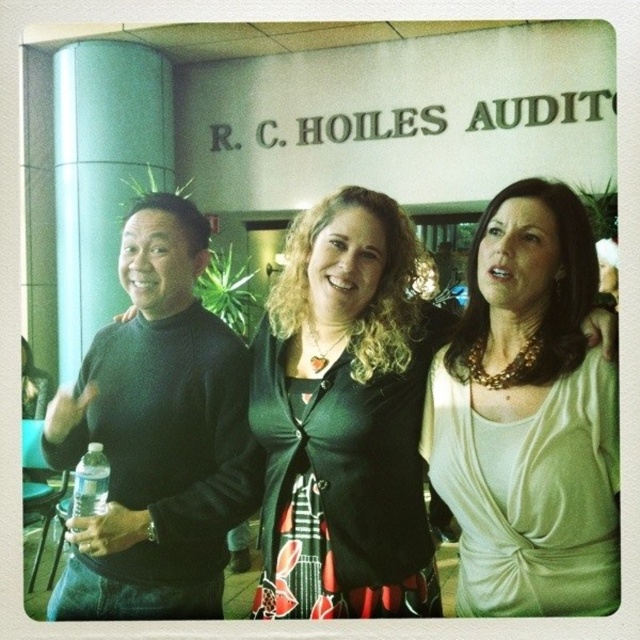
Question: Which point appears closest to the camera in this image?

Choices:
 (A) (108, 468)
 (B) (296, 582)
 (C) (518, 326)

Answer: (C)

Question: From the image, what is the correct spatial relationship of black matte sweater at left in relation to clear plastic bottle at lower left?

Choices:
 (A) above
 (B) below

Answer: (A)

Question: Does black matte cardigan at center have a greater width compared to black matte sweater at left?

Choices:
 (A) yes
 (B) no

Answer: (A)

Question: Which of the following is the farthest from the observer?

Choices:
 (A) (104, 388)
 (B) (76, 492)
 (C) (484, 365)

Answer: (A)

Question: Which of the following is the closest to the observer?

Choices:
 (A) click(390, 268)
 (B) click(76, 531)
 (C) click(563, 232)
 (D) click(100, 554)

Answer: (C)

Question: Does black matte sweater at left appear under clear plastic bottle at lower left?

Choices:
 (A) no
 (B) yes

Answer: (A)